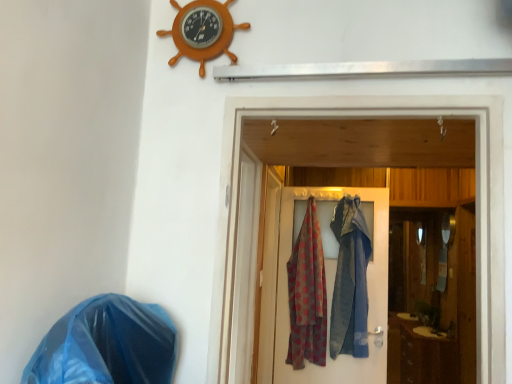
Question: Can you confirm if orange wood ship wheel at upper center is wider than wooden door at center, which is the 2th door in back-to-front order?

Choices:
 (A) no
 (B) yes

Answer: (A)

Question: Is orange wood ship wheel at upper center behind wooden door at center, which is the 2th door in back-to-front order?

Choices:
 (A) yes
 (B) no

Answer: (A)

Question: From a real-world perspective, is orange wood ship wheel at upper center over wooden door at center, the 1th door in the front-to-back sequence?

Choices:
 (A) yes
 (B) no

Answer: (A)

Question: Is orange wood ship wheel at upper center smaller than wooden door at center, which is the 2th door in back-to-front order?

Choices:
 (A) yes
 (B) no

Answer: (A)

Question: Is orange wood ship wheel at upper center positioned with its back to wooden door at center, the 1th door in the front-to-back sequence?

Choices:
 (A) yes
 (B) no

Answer: (B)

Question: Is orange wood ship wheel at upper center taller than wooden door at center, which is the 2th door in back-to-front order?

Choices:
 (A) yes
 (B) no

Answer: (B)

Question: Can you confirm if orange wood ship wheel at upper center is thinner than blue plastic bag at lower left?

Choices:
 (A) no
 (B) yes

Answer: (B)

Question: Is orange wood ship wheel at upper center smaller than blue plastic bag at lower left?

Choices:
 (A) no
 (B) yes

Answer: (B)

Question: From the image's perspective, is orange wood ship wheel at upper center located beneath blue plastic bag at lower left?

Choices:
 (A) no
 (B) yes

Answer: (A)

Question: From a real-world perspective, is orange wood ship wheel at upper center positioned over blue plastic bag at lower left based on gravity?

Choices:
 (A) yes
 (B) no

Answer: (A)

Question: Is orange wood ship wheel at upper center shorter than blue plastic bag at lower left?

Choices:
 (A) no
 (B) yes

Answer: (A)

Question: Considering the relative sizes of orange wood ship wheel at upper center and blue plastic bag at lower left in the image provided, is orange wood ship wheel at upper center taller than blue plastic bag at lower left?

Choices:
 (A) yes
 (B) no

Answer: (A)

Question: Could you tell me if polka dot fabric at center is turned towards blue plastic bag at lower left?

Choices:
 (A) no
 (B) yes

Answer: (B)